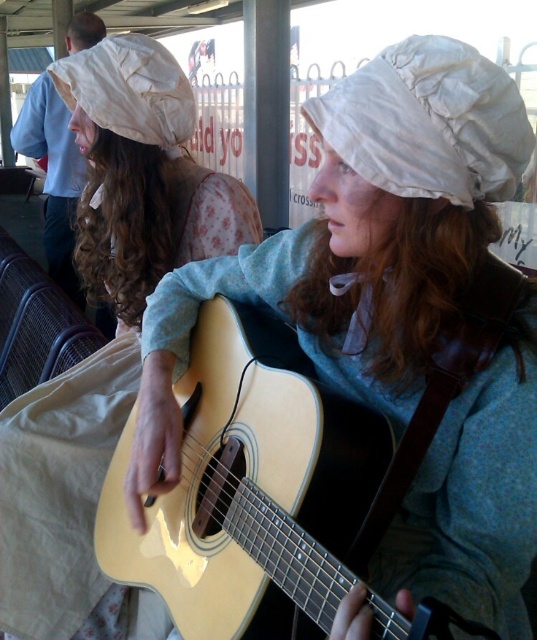
Is matte white hat at upper center wider than light wood acoustic guitar at center?

Correct, the width of matte white hat at upper center exceeds that of light wood acoustic guitar at center.

Where is `matte white hat at upper center`? This screenshot has width=537, height=640. matte white hat at upper center is located at coordinates point(112,340).

Does light wood acoustic guitar at center appear under white puffy hat at upper center?

Yes.

Does light wood acoustic guitar at center have a greater width compared to white puffy hat at upper center?

Correct, the width of light wood acoustic guitar at center exceeds that of white puffy hat at upper center.

Locate an element on the screen. light wood acoustic guitar at center is located at coordinates (250, 484).

Locate an element on the screen. Image resolution: width=537 pixels, height=640 pixels. light wood acoustic guitar at center is located at coordinates (250, 484).

Between point (482, 106) and point (453, 134), which one is positioned behind?

The point (453, 134) is more distant.

Between point (440, 448) and point (309, 99), which one is positioned behind?

The point (440, 448) is more distant.

Locate an element on the screen. The image size is (537, 640). matte white hat at center is located at coordinates (359, 237).